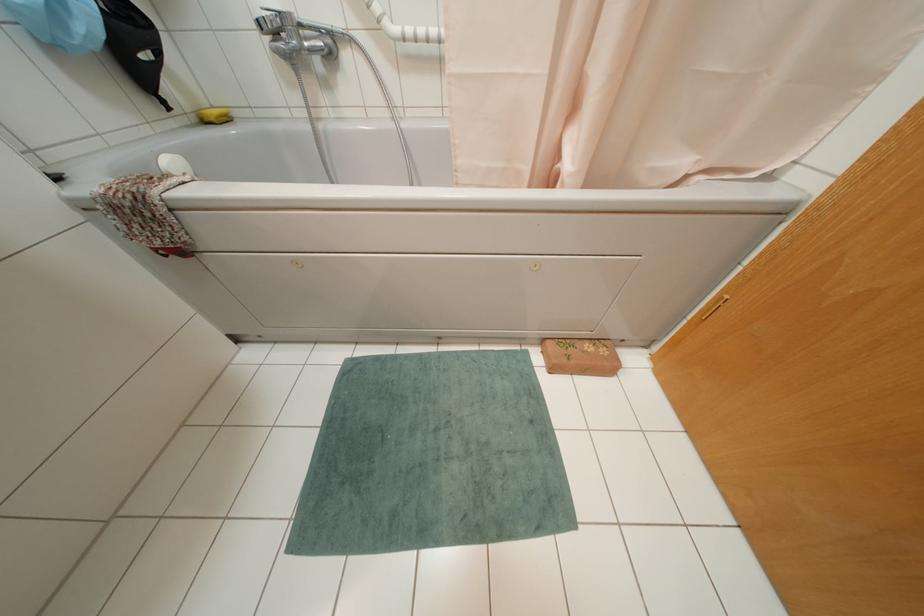
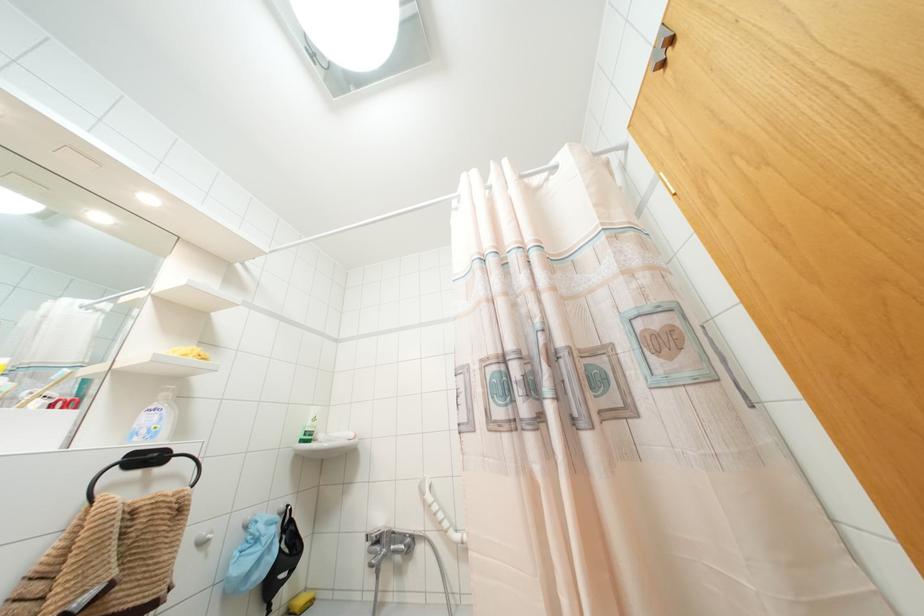
Locate, in the second image, the point that corresponds to point 300,34 in the first image.

(390, 541)